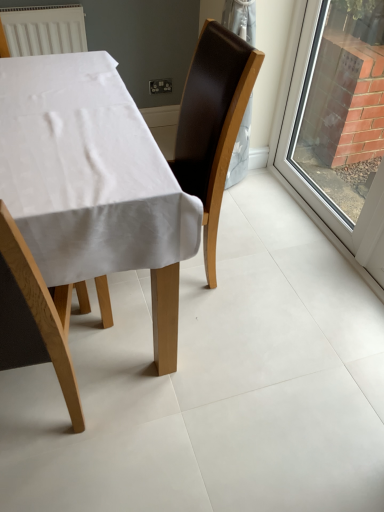
In order to click on white fabric-covered table at center in this screenshot , I will do `click(87, 172)`.

Where is `white fabric-covered table at center`? The width and height of the screenshot is (384, 512). white fabric-covered table at center is located at coordinates (87, 172).

Is brown leather chair at center, the first chair positioned from the back, not close to wooden chair at lower left, which is counted as the second chair, starting from the back?

Actually, brown leather chair at center, the first chair positioned from the back, and wooden chair at lower left, which is counted as the second chair, starting from the back, are a little close together.

Between brown leather chair at center, the first chair positioned from the back, and wooden chair at lower left, which is counted as the second chair, starting from the back, which one has smaller size?

wooden chair at lower left, which is counted as the second chair, starting from the back.

Is brown leather chair at center, the first chair positioned from the back, positioned with its back to wooden chair at lower left, the first chair viewed from the front?

No, brown leather chair at center, the first chair positioned from the back, is not facing the opposite direction of wooden chair at lower left, the first chair viewed from the front.

Is brown leather chair at center, the 2th chair from the front, located outside wooden chair at lower left, the first chair viewed from the front?

Absolutely, brown leather chair at center, the 2th chair from the front, is external to wooden chair at lower left, the first chair viewed from the front.

Locate an element on the screen. Image resolution: width=384 pixels, height=512 pixels. window that appears above the wooden chair at lower left, the first chair viewed from the front (from a real-world perspective) is located at coordinates (296, 139).

Which object is closer to the camera taking this photo, clear glass window at right or wooden chair at lower left, the first chair viewed from the front?

wooden chair at lower left, the first chair viewed from the front, is closer to the camera.

Is clear glass window at right looking in the opposite direction of wooden chair at lower left, the first chair viewed from the front?

No.

Which point is more distant from viewer, (309, 31) or (4, 358)?

The point (309, 31) is more distant.

Considering the sizes of objects wooden chair at lower left, the first chair viewed from the front, and white fabric-covered table at center in the image provided, who is thinner, wooden chair at lower left, the first chair viewed from the front, or white fabric-covered table at center?

wooden chair at lower left, the first chair viewed from the front.

Identify the location of the 1st chair positioned above the white fabric-covered table at center (from a real-world perspective). The image size is (384, 512). (36, 315).

Which of these two, wooden chair at lower left, the first chair viewed from the front, or white fabric-covered table at center, is smaller?

With smaller size is wooden chair at lower left, the first chair viewed from the front.

Could you tell me if wooden chair at lower left, the first chair viewed from the front, is turned towards white fabric-covered table at center?

Yes, wooden chair at lower left, the first chair viewed from the front, is aimed at white fabric-covered table at center.

Does white fabric-covered table at center have a greater width compared to clear glass window at right?

Yes.

Which object is positioned more to the left, white fabric-covered table at center or clear glass window at right?

Positioned to the left is white fabric-covered table at center.

Is white fabric-covered table at center turned away from clear glass window at right?

No.

From a real-world perspective, relative to white fabric-covered table at center, is clear glass window at right vertically above or below?

clear glass window at right is above white fabric-covered table at center.

Is clear glass window at right wider or thinner than white fabric-covered table at center?

Clearly, clear glass window at right has less width compared to white fabric-covered table at center.

Between clear glass window at right and white fabric-covered table at center, which one is positioned behind?

Positioned behind is clear glass window at right.

Is wooden chair at lower left, which is counted as the second chair, starting from the back, surrounded by white fabric-covered table at center?

Yes, wooden chair at lower left, which is counted as the second chair, starting from the back, is inside white fabric-covered table at center.

Can you confirm if white fabric-covered table at center is positioned to the left of wooden chair at lower left, the first chair viewed from the front?

No.

Does white fabric-covered table at center have a greater width compared to wooden chair at lower left, which is counted as the second chair, starting from the back?

Correct, the width of white fabric-covered table at center exceeds that of wooden chair at lower left, which is counted as the second chair, starting from the back.

From the image's perspective, would you say white fabric-covered table at center is shown under wooden chair at lower left, the first chair viewed from the front?

Incorrect, from the image's perspective, white fabric-covered table at center is higher than wooden chair at lower left, the first chair viewed from the front.

Measure the distance between wooden chair at lower left, the first chair viewed from the front, and brown leather chair at center, the 2th chair from the front.

The distance of wooden chair at lower left, the first chair viewed from the front, from brown leather chair at center, the 2th chair from the front, is 24.50 inches.

From a real-world perspective, who is located lower, wooden chair at lower left, which is counted as the second chair, starting from the back, or brown leather chair at center, the 2th chair from the front?

wooden chair at lower left, which is counted as the second chair, starting from the back, is physically lower.

From the image's perspective, is wooden chair at lower left, which is counted as the second chair, starting from the back, on top of brown leather chair at center, the 2th chair from the front?

Actually, wooden chair at lower left, which is counted as the second chair, starting from the back, appears below brown leather chair at center, the 2th chair from the front, in the image.

Can you confirm if wooden chair at lower left, the first chair viewed from the front, is taller than brown leather chair at center, the 2th chair from the front?

Yes.

Image resolution: width=384 pixels, height=512 pixels. What are the coordinates of `chair located in front of the brown leather chair at center, the 2th chair from the front` in the screenshot? It's located at (36, 315).

This screenshot has height=512, width=384. I want to click on window on the right of wooden chair at lower left, which is counted as the second chair, starting from the back, so (x=296, y=139).

Which object lies nearer to the anchor point white fabric-covered table at center, wooden chair at lower left, the first chair viewed from the front, or clear glass window at right?

wooden chair at lower left, the first chair viewed from the front, is positioned closer to the anchor white fabric-covered table at center.

Estimate the real-world distances between objects in this image. Which object is further from brown leather chair at center, the 2th chair from the front, white fabric-covered table at center or clear glass window at right?

clear glass window at right.

Based on their spatial positions, is brown leather chair at center, the first chair positioned from the back, or wooden chair at lower left, which is counted as the second chair, starting from the back, further from white fabric-covered table at center?

brown leather chair at center, the first chair positioned from the back, lies further to white fabric-covered table at center than the other object.

Based on their spatial positions, is wooden chair at lower left, the first chair viewed from the front, or brown leather chair at center, the first chair positioned from the back, closer to clear glass window at right?

Based on the image, brown leather chair at center, the first chair positioned from the back, appears to be nearer to clear glass window at right.

Based on their spatial positions, is clear glass window at right or brown leather chair at center, the first chair positioned from the back, further from white fabric-covered table at center?

clear glass window at right lies further to white fabric-covered table at center than the other object.

From the image, which object appears to be farther from wooden chair at lower left, the first chair viewed from the front, clear glass window at right or white fabric-covered table at center?

clear glass window at right lies further to wooden chair at lower left, the first chair viewed from the front, than the other object.

Estimate the real-world distances between objects in this image. Which object is closer to clear glass window at right, white fabric-covered table at center or brown leather chair at center, the 2th chair from the front?

brown leather chair at center, the 2th chair from the front, lies closer to clear glass window at right than the other object.

Based on their spatial positions, is brown leather chair at center, the first chair positioned from the back, or wooden chair at lower left, which is counted as the second chair, starting from the back, further from clear glass window at right?

Based on the image, wooden chair at lower left, which is counted as the second chair, starting from the back, appears to be further to clear glass window at right.

The height and width of the screenshot is (512, 384). I want to click on table that lies between brown leather chair at center, the 2th chair from the front, and wooden chair at lower left, which is counted as the second chair, starting from the back, from top to bottom, so click(87, 172).

Identify the location of table between wooden chair at lower left, which is counted as the second chair, starting from the back, and clear glass window at right from left to right. Image resolution: width=384 pixels, height=512 pixels. (87, 172).

Locate an element on the screen. chair between wooden chair at lower left, the first chair viewed from the front, and clear glass window at right from left to right is located at coordinates (212, 123).

This screenshot has height=512, width=384. Find the location of `chair situated between white fabric-covered table at center and clear glass window at right from left to right`. chair situated between white fabric-covered table at center and clear glass window at right from left to right is located at coordinates (212, 123).